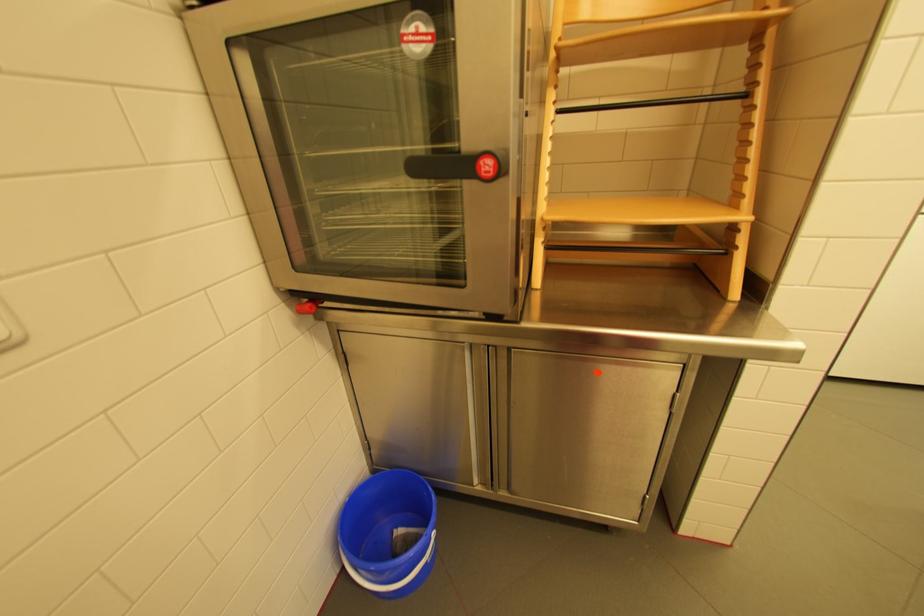
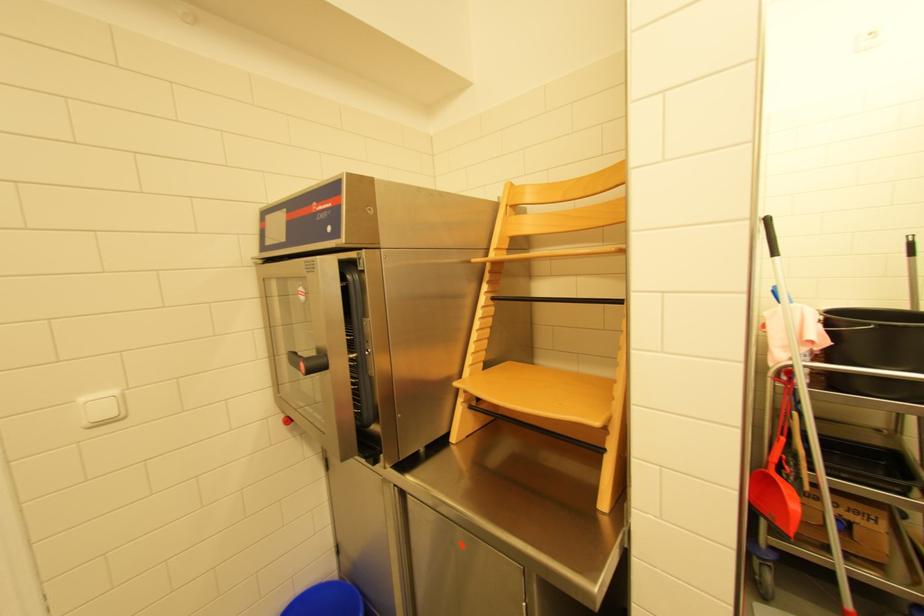
Based on the continuous images, in which direction is the camera rotating?

The camera's rotation is toward left-up.